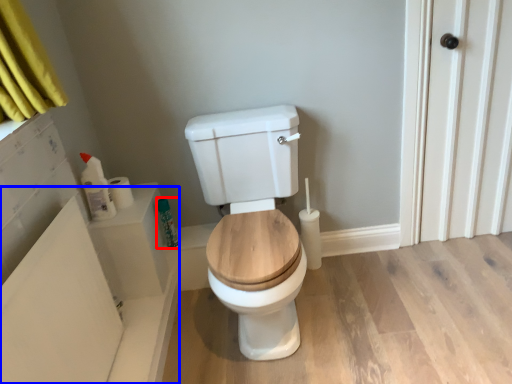
Question: Which object appears closest to the camera in this image, toiletry (highlighted by a red box) or bath (highlighted by a blue box)?

Choices:
 (A) toiletry
 (B) bath

Answer: (B)